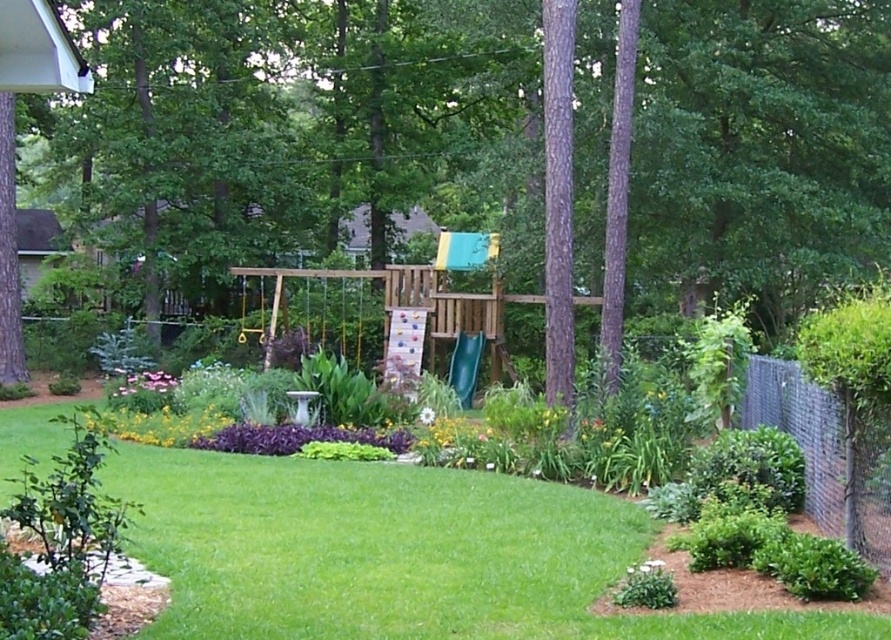
You are standing at the edge of the lawn in the backyard garden and want to reach the green plastic slide at center. Which direction should you move to get there?

The green plastic slide at center is located at point coordinates, so you should move towards the center of the backyard garden to reach it.

You are a child playing in the backyard garden and want to reach the pink matte flower at lower left from the green plastic slide at center. Which direction should you move to get closer to the flower?

The green plastic slide at center is further to the viewer than the pink matte flower at lower left, so to reach the flower, you should move forward away from the slide towards the lower left area.

You are a parent supervising children playing in the backyard. You see the green rough bark tree at center and the green plastic slide at center. Which object is closer to the ground?

The green plastic slide at center is closer to the ground because the green rough bark tree at center is positioned over it.